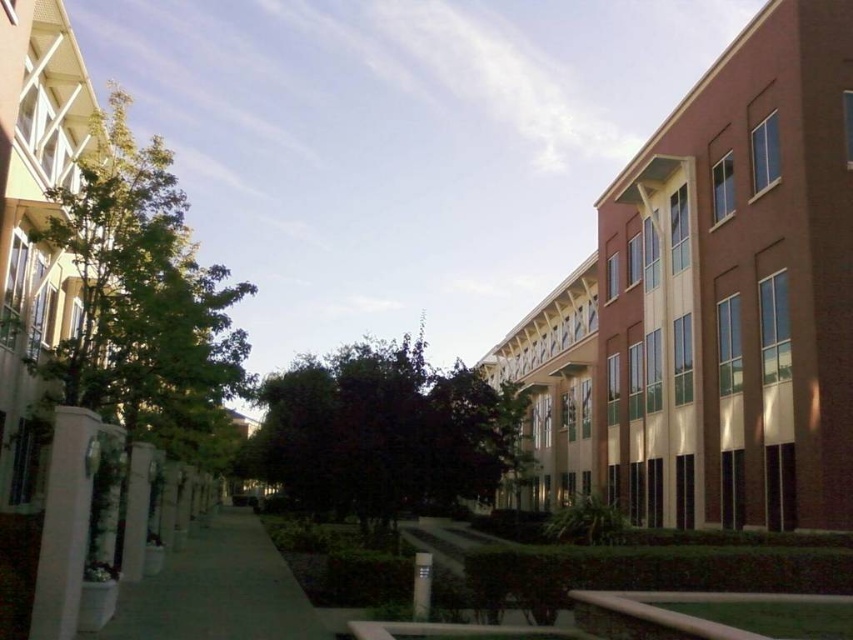
You are a city planner assessing the courtyard layout. The green leafy tree at left and the green concrete sidewalk at center are both important for the space. Based on their sizes, which one occupies more horizontal space in the courtyard?

The green leafy tree at left is wider than the green concrete sidewalk at center, so it occupies more horizontal space in the courtyard.

You are standing on the green concrete sidewalk at center and want to walk to the building with the reddish brown facade on the right. Which direction should you head relative to the green leafy tree at left?

You should head to the right of the green leafy tree at left since the building with the reddish brown facade is on the right side of the courtyard, and the green leafy tree at left is positioned to the left of the green concrete sidewalk at center.

You are a city planner evaluating this space. You need to determine if the green leafy tree at left can be safely transplanted to the location currently occupied by the green concrete sidewalk at center. Based on the size of the tree and the sidewalk, is this feasible?

The green leafy tree at left is larger in size than the green concrete sidewalk at center. Since the sidewalk is smaller than the tree, transplanting the tree to that location may not be feasible as the sidewalk area might not accommodate the tree properly.